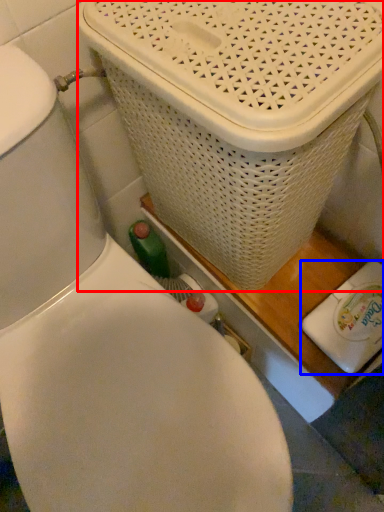
Question: Which of the following is the closest to the observer, basket container (highlighted by a red box) or appliance (highlighted by a blue box)?

Choices:
 (A) basket container
 (B) appliance

Answer: (A)